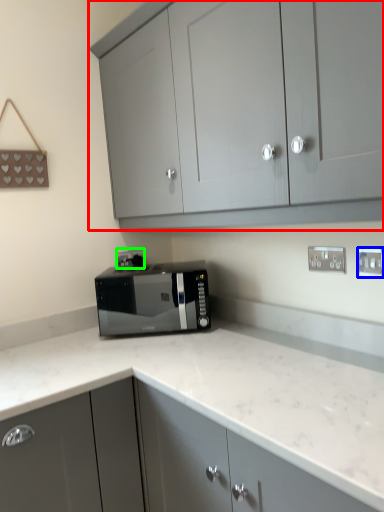
Question: Which object is positioned farthest from cabinetry (highlighted by a red box)? Select from electric outlet (highlighted by a blue box) and electric outlet (highlighted by a green box).

Choices:
 (A) electric outlet
 (B) electric outlet

Answer: (B)